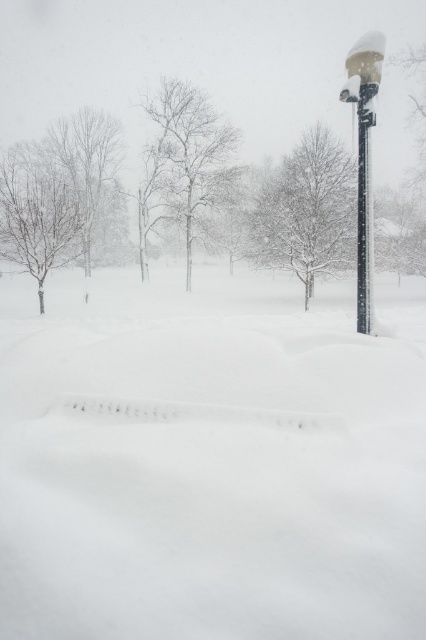
Does point (109, 234) lie in front of point (419, 168)?

No, it is not.

Who is lower down, snow-covered branches at center or white snow-covered tree at upper right?

snow-covered branches at center is lower down.

Describe the element at coordinates (92, 173) in the screenshot. I see `snow-covered branches at center` at that location.

You are a GUI agent. You are given a task and a screenshot of the screen. Output one action in this format:
    pyautogui.click(x=<x>, y=<y>)
    Task: Click on the snow-covered branches at center
    
    Given the screenshot: What is the action you would take?
    pyautogui.click(x=92, y=173)

Which is below, white fluffy snow at center or snow-covered tree at center?

Positioned lower is white fluffy snow at center.

Where is `white fluffy snow at center`? The image size is (426, 640). white fluffy snow at center is located at coordinates (210, 460).

Is point (71, 129) closer to camera compared to point (367, 134)?

No, it is not.

Which is in front, point (77, 156) or point (368, 120)?

Point (368, 120) is more forward.

Is point (103, 179) farther from camera compared to point (357, 204)?

Yes, it is behind point (357, 204).

Identify the location of snow-covered branches at center. The height and width of the screenshot is (640, 426). (92, 173).